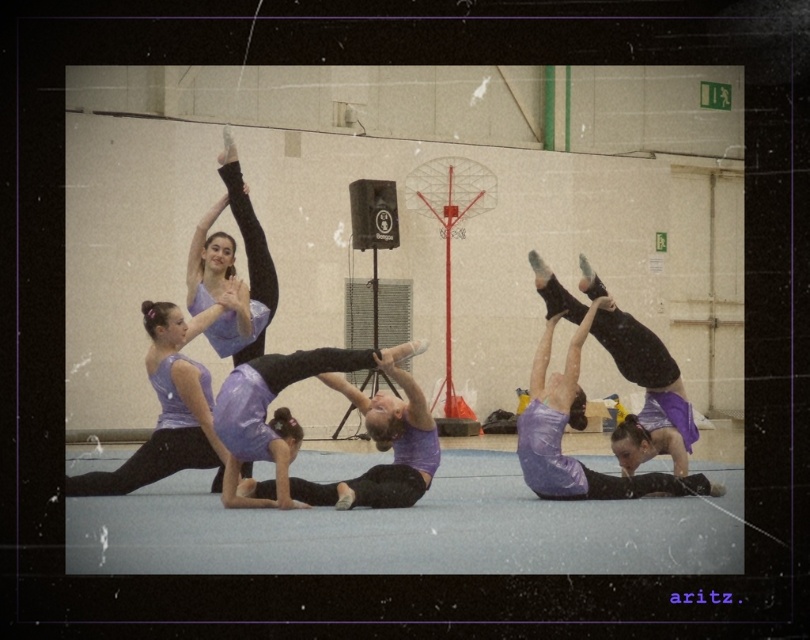
You are standing at the origin point in the gymnasium where the dancers are performing. You see two points marked on the floor at coordinates point (185, 458) and point (590, 289). If you were to walk towards both points, which point would you reach first?

Point (185, 458) is in front of point (590, 289), so you would reach point (185, 458) first.

Consider the image. You are standing in the gymnasium and want to know how far the point at coordinates (651, 378) is from your current position. Can you determine the distance?

The distance of point (651, 378) from the camera is 16.86 meters, so the point is 16.86 meters away from your current position.